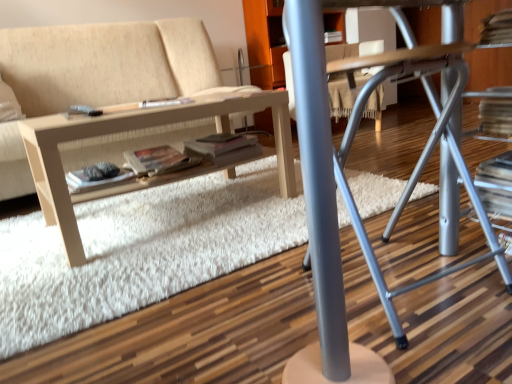
Measure the distance between point (165, 163) and camera.

They are 5.42 feet apart.

The width and height of the screenshot is (512, 384). Identify the location of matte paper paperback book at center, the second paperback book viewed from the left. (154, 160).

What is the approximate height of metallic gray computer desk at center?

metallic gray computer desk at center is 25.92 inches in height.

Locate an element on the screen. This screenshot has height=384, width=512. white matte paperback book at center, which is counted as the 2th paperback book, starting from the right is located at coordinates pos(96,180).

Measure the distance between white shag rug at center and camera.

They are 36.89 inches apart.

From the picture: In order to face white shag rug at center, should I rotate leftwards or rightwards?

To align with it, rotate left about 12.105°.

The image size is (512, 384). Describe the element at coordinates (106, 63) in the screenshot. I see `beige fabric couch at center` at that location.

Identify the location of matte paper paperback book at center, the first paperback book viewed from the right. The width and height of the screenshot is (512, 384). coord(154,160).

Considering the sizes of objects white shag rug at center and beige fabric couch at center in the image provided, who is bigger, white shag rug at center or beige fabric couch at center?

With larger size is beige fabric couch at center.

In the scene shown: Which object is thinner, white shag rug at center or beige fabric couch at center?

With smaller width is beige fabric couch at center.

At what (x,y) coordinates should I click in order to perform the action: click on plain below the beige fabric couch at center (from a real-world perspective). Please return your answer as a coordinate pair (x, y). Looking at the image, I should click on (139, 251).

Which is correct: beige fabric couch at center is inside white shag rug at center, or outside of it?

beige fabric couch at center is not inside white shag rug at center, it's outside.

Is beige fabric couch at center turned away from white shag rug at center?

No.

From the image's perspective, who appears lower, beige fabric couch at center or white shag rug at center?

white shag rug at center.

Based on their sizes in the image, would you say matte gray magazine at center is bigger or smaller than white matte paperback book at center, positioned as the first paperback book in left-to-right order?

Clearly, matte gray magazine at center is smaller in size than white matte paperback book at center, positioned as the first paperback book in left-to-right order.

Is matte gray magazine at center located outside white matte paperback book at center, positioned as the first paperback book in left-to-right order?

Absolutely, matte gray magazine at center is external to white matte paperback book at center, positioned as the first paperback book in left-to-right order.

Find the location of a particular element. This screenshot has height=384, width=512. the 2nd paperback book below the matte gray magazine at center (from a real-world perspective) is located at coordinates (96, 180).

Is matte gray magazine at center placed right next to white matte paperback book at center, which is counted as the 2th paperback book, starting from the right?

matte gray magazine at center and white matte paperback book at center, which is counted as the 2th paperback book, starting from the right, are not in contact.

Between white shag rug at center and light wood/texture table at lower left, which one is positioned behind?

Positioned behind is light wood/texture table at lower left.

From a real-world perspective, is white shag rug at center positioned above or below light wood/texture table at lower left?

white shag rug at center is below light wood/texture table at lower left.

Which is in front, point (19, 248) or point (192, 105)?

Point (192, 105)

Is white shag rug at center turned away from light wood/texture table at lower left?

No, white shag rug at center is not facing away from light wood/texture table at lower left.

Is metallic gray computer desk at center taller or shorter than light wood/texture table at lower left?

In the image, metallic gray computer desk at center appears to be taller than light wood/texture table at lower left.

Is metallic gray computer desk at center looking in the opposite direction of light wood/texture table at lower left?

No, metallic gray computer desk at center is not facing the opposite direction of light wood/texture table at lower left.

Between metallic gray computer desk at center and light wood/texture table at lower left, which one is positioned in front?

metallic gray computer desk at center is closer to the camera.

Considering the relative positions of metallic gray computer desk at center and light wood/texture table at lower left in the image provided, is metallic gray computer desk at center to the left of light wood/texture table at lower left from the viewer's perspective?

Incorrect, metallic gray computer desk at center is not on the left side of light wood/texture table at lower left.

Can you confirm if metallic gray computer desk at center is smaller than matte gray magazine at center?

Actually, metallic gray computer desk at center might be larger than matte gray magazine at center.

The height and width of the screenshot is (384, 512). Identify the location of computer desk on the right of matte gray magazine at center. (417, 162).

Could matte gray magazine at center be considered to be inside metallic gray computer desk at center?

Definitely not — matte gray magazine at center is not inside metallic gray computer desk at center.

Relative to matte gray magazine at center, is metallic gray computer desk at center in front or behind?

In the image, metallic gray computer desk at center appears in front of matte gray magazine at center.

From the image's perspective, between light wood/texture table at lower left and white shag rug at center, who is located below?

white shag rug at center, from the image's perspective.

Can you confirm if light wood/texture table at lower left is positioned to the right of white shag rug at center?

No.

Can you tell me how much light wood/texture table at lower left and white shag rug at center differ in facing direction?

There is a 4.69e-05-degree angle between the facing directions of light wood/texture table at lower left and white shag rug at center.

Is light wood/texture table at lower left completely or partially outside of white shag rug at center?

That's correct, light wood/texture table at lower left is outside of white shag rug at center.

Locate an element on the screen. plain in front of the beige fabric couch at center is located at coordinates (139, 251).

Locate an element on the screen. This screenshot has width=512, height=384. studio couch on the left of white shag rug at center is located at coordinates (106, 63).

Which object lies further to the anchor point matte paper paperback book at center, the second paperback book viewed from the left, matte gray magazine at center or light wood/texture table at lower left?

Based on the image, light wood/texture table at lower left appears to be further to matte paper paperback book at center, the second paperback book viewed from the left.

Based on their spatial positions, is white matte paperback book at center, positioned as the first paperback book in left-to-right order, or beige fabric couch at center closer to matte gray magazine at center?

The object closer to matte gray magazine at center is white matte paperback book at center, positioned as the first paperback book in left-to-right order.

Looking at the image, which one is located further to beige fabric couch at center, light wood/texture table at lower left or matte gray magazine at center?

matte gray magazine at center lies further to beige fabric couch at center than the other object.

Based on their spatial positions, is white matte paperback book at center, positioned as the first paperback book in left-to-right order, or matte gray magazine at center closer to matte paper paperback book at center, the second paperback book viewed from the left?

Among the two, white matte paperback book at center, positioned as the first paperback book in left-to-right order, is located nearer to matte paper paperback book at center, the second paperback book viewed from the left.

Looking at the image, which one is located further to beige fabric couch at center, white shag rug at center or white matte paperback book at center, which is counted as the 2th paperback book, starting from the right?

white matte paperback book at center, which is counted as the 2th paperback book, starting from the right, is positioned further to the anchor beige fabric couch at center.

Looking at the image, which one is located further to beige fabric couch at center, white matte paperback book at center, positioned as the first paperback book in left-to-right order, or light wood/texture table at lower left?

Among the two, white matte paperback book at center, positioned as the first paperback book in left-to-right order, is located further to beige fabric couch at center.

Based on the photo, which object lies nearer to the anchor point matte gray magazine at center, matte paper paperback book at center, the first paperback book viewed from the right, or metallic gray computer desk at center?

Based on the image, matte paper paperback book at center, the first paperback book viewed from the right, appears to be nearer to matte gray magazine at center.

Looking at the image, which one is located further to beige fabric couch at center, metallic gray computer desk at center or white shag rug at center?

The object further to beige fabric couch at center is metallic gray computer desk at center.

In order to click on magazine positioned between white shag rug at center and beige fabric couch at center from near to far in this screenshot , I will do `click(165, 102)`.

The width and height of the screenshot is (512, 384). In order to click on table between metallic gray computer desk at center and matte gray magazine at center in the front-back direction in this screenshot , I will do tap(138, 128).

Image resolution: width=512 pixels, height=384 pixels. I want to click on table between white shag rug at center and white matte paperback book at center, which is counted as the 2th paperback book, starting from the right, from front to back, so click(x=138, y=128).

This screenshot has height=384, width=512. In order to click on table between white shag rug at center and beige fabric couch at center from front to back in this screenshot , I will do `click(138, 128)`.